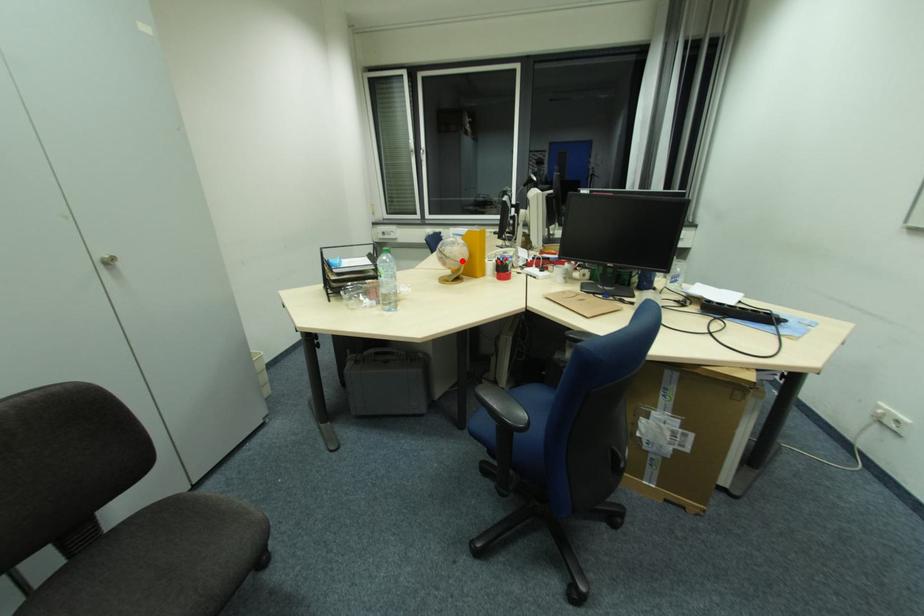
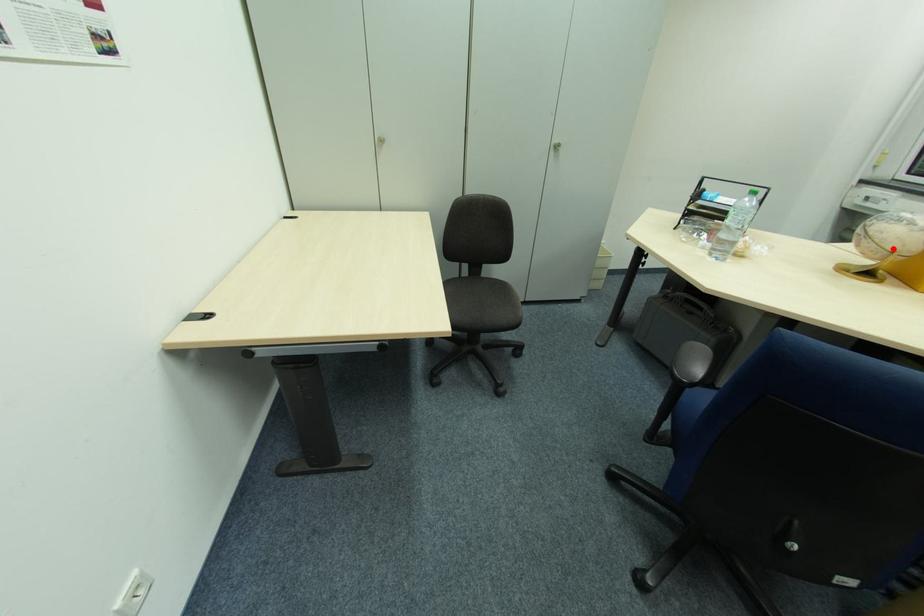
I am providing you with two images of the same scene from different viewpoints. A red point is marked on the first image and another point is marked on the second image. Is the red point in image1 aligned with the point shown in image2?

Yes